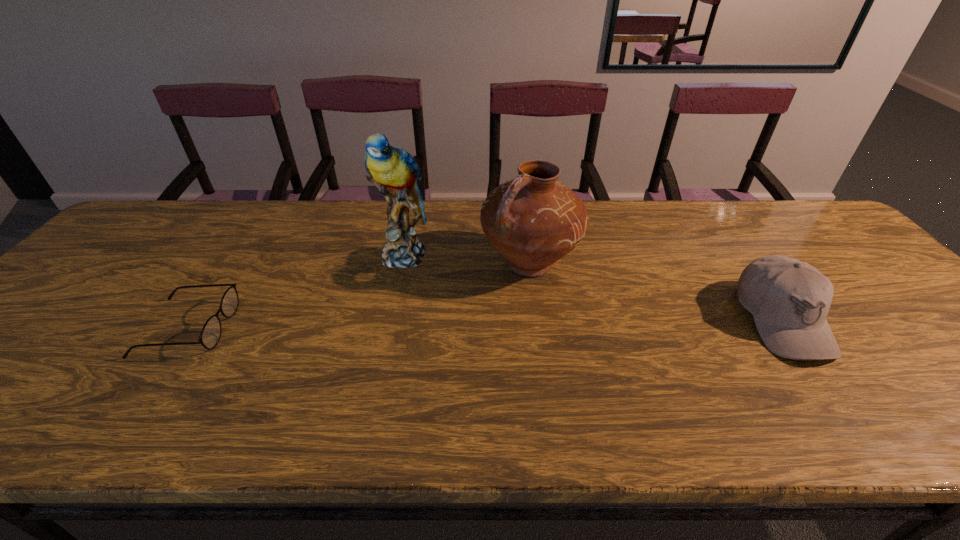
I want to click on spectacles, so coord(210,335).

The width and height of the screenshot is (960, 540). Find the location of `the shortest object`. the shortest object is located at coordinates (210, 335).

Locate an element on the screen. This screenshot has width=960, height=540. the rightmost object is located at coordinates (789, 299).

I want to click on the second shortest object, so click(789, 299).

You are a GUI agent. You are given a task and a screenshot of the screen. Output one action in this format:
    pyautogui.click(x=<x>, y=<y>)
    Task: Click on the pottery
    Image resolution: width=960 pixels, height=540 pixels.
    Given the screenshot: What is the action you would take?
    pyautogui.click(x=533, y=220)

You are a GUI agent. You are given a task and a screenshot of the screen. Output one action in this format:
    pyautogui.click(x=<x>, y=<y>)
    Task: Click on the second tallest object
    The image size is (960, 540).
    Given the screenshot: What is the action you would take?
    pyautogui.click(x=533, y=220)

At what (x,y) coordinates should I click in order to perform the action: click on parrot. Please return your answer as a coordinate pair (x, y). This screenshot has height=540, width=960. Looking at the image, I should click on (394, 171).

You are a GUI agent. You are given a task and a screenshot of the screen. Output one action in this format:
    pyautogui.click(x=<x>, y=<y>)
    Task: Click on the third object from right to left
    The height and width of the screenshot is (540, 960).
    Given the screenshot: What is the action you would take?
    coord(394,171)

Locate an element on the screen. This screenshot has width=960, height=540. vacant space located 0.130m on the front-facing side of the shortest object is located at coordinates tap(283, 328).

The width and height of the screenshot is (960, 540). What are the coordinates of `vacant region located on the side of the pottery with the handle` in the screenshot? It's located at (435, 320).